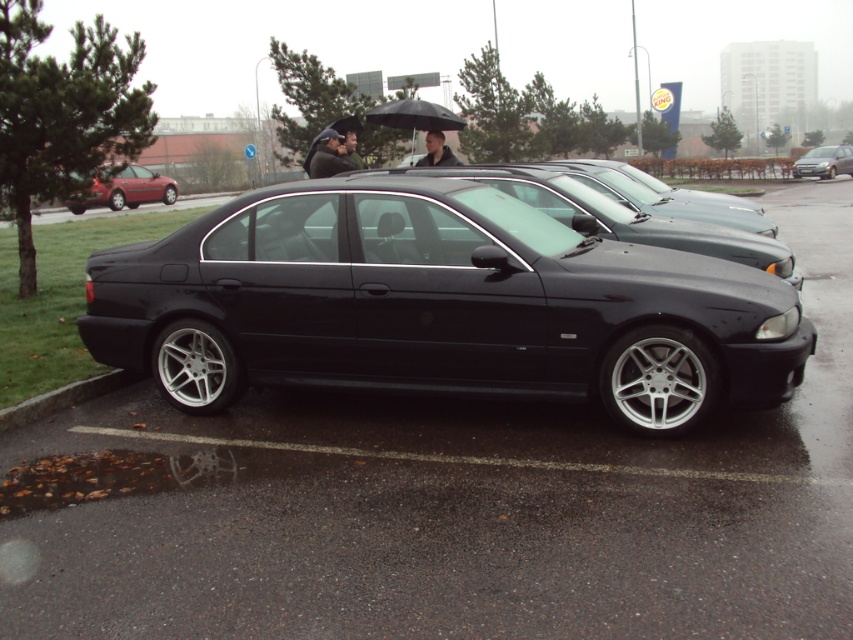
You are standing in the parking lot and see two points marked in the image. The first point is at coordinates point (556, 164) and the second is at point (131, 195). Which point is closer to you?

Point (556, 164) is closer to the viewer than point (131, 195).

Consider the image. You are a car enthusiast who wants to compare two BMW sedans in the parking lot. You see the shiny black sedan at center and the black glossy sedan at center. Which one is taller?

The shiny black sedan at center is much taller than the black glossy sedan at center.

You are a car enthusiast who wants to compare the two BMW sedans in the image. Which one is shorter in height between the black glossy sedan at center and the metallic red sedan at left?

The black glossy sedan at center has a lesser height compared to the metallic red sedan at left, so the black glossy sedan at center is shorter in height.